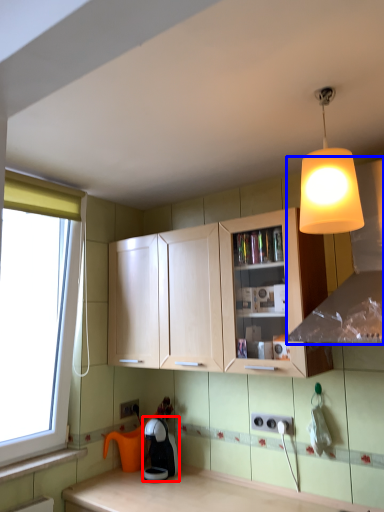
Question: Which point is closer to the camera, coffee machine (highlighted by a red box) or exhaust hood (highlighted by a blue box)?

Choices:
 (A) coffee machine
 (B) exhaust hood

Answer: (B)